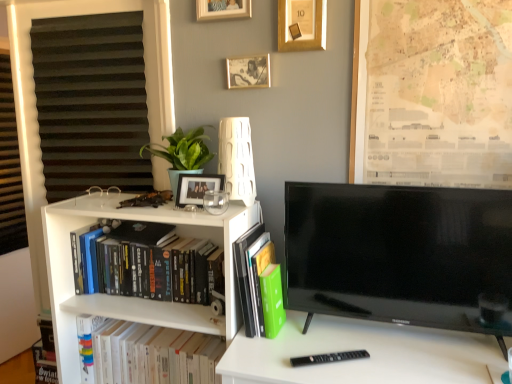
You are a GUI agent. You are given a task and a screenshot of the screen. Output one action in this format:
    pyautogui.click(x=<x>, y=<y>)
    Task: Click on the free space that is to the left of black glossy tv at right
    The height and width of the screenshot is (384, 512).
    Given the screenshot: What is the action you would take?
    pyautogui.click(x=309, y=350)